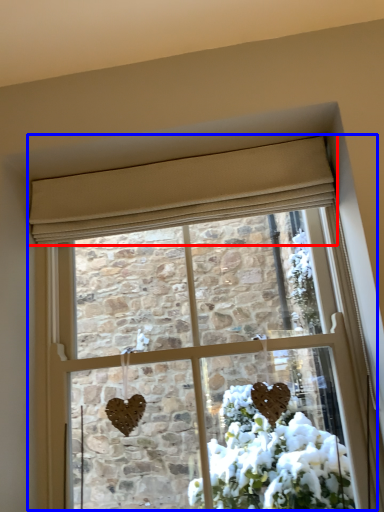
Question: Among these objects, which one is nearest to the camera, curtain (highlighted by a red box) or window (highlighted by a blue box)?

Choices:
 (A) curtain
 (B) window

Answer: (B)